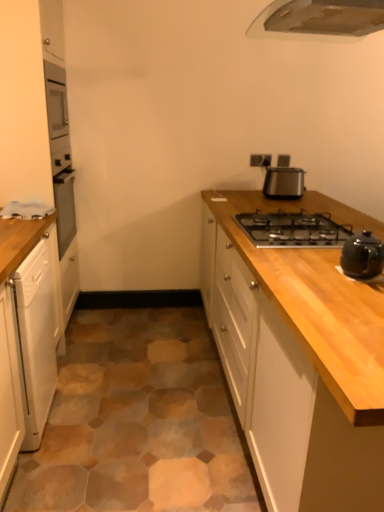
Question: Is metallic stainless steel toaster at upper right, marked as the first kitchen appliance in a back-to-front arrangement, outside of wooden cabinet at center, positioned as the first cabinetry in right-to-left order?

Choices:
 (A) no
 (B) yes

Answer: (B)

Question: Considering the relative sizes of metallic stainless steel toaster at upper right, the 2th kitchen appliance from the bottom, and wooden cabinet at center, the 3th cabinetry from the left, in the image provided, is metallic stainless steel toaster at upper right, the 2th kitchen appliance from the bottom, bigger than wooden cabinet at center, the 3th cabinetry from the left,?

Choices:
 (A) yes
 (B) no

Answer: (B)

Question: Does metallic stainless steel toaster at upper right, marked as the first kitchen appliance in a back-to-front arrangement, have a lesser width compared to wooden cabinet at center, the 3th cabinetry from the left?

Choices:
 (A) yes
 (B) no

Answer: (A)

Question: From the image's perspective, is metallic stainless steel toaster at upper right, the 2th kitchen appliance from the bottom, located beneath wooden cabinet at center, the 3th cabinetry from the left?

Choices:
 (A) yes
 (B) no

Answer: (B)

Question: Is metallic stainless steel toaster at upper right, marked as the first kitchen appliance in a back-to-front arrangement, aimed at wooden cabinet at center, the 3th cabinetry from the left?

Choices:
 (A) no
 (B) yes

Answer: (A)

Question: Looking at their shapes, would you say metallic stainless steel toaster at upper right, the 2th kitchen appliance from the bottom, is wider or thinner than metallic silver outlet at upper right?

Choices:
 (A) wide
 (B) thin

Answer: (A)

Question: Is metallic stainless steel toaster at upper right, marked as the first kitchen appliance in a back-to-front arrangement, to the left or to the right of metallic silver outlet at upper right in the image?

Choices:
 (A) left
 (B) right

Answer: (B)

Question: Considering the positions of metallic stainless steel toaster at upper right, which is counted as the 2th kitchen appliance, starting from the front, and metallic silver outlet at upper right in the image, is metallic stainless steel toaster at upper right, which is counted as the 2th kitchen appliance, starting from the front, taller or shorter than metallic silver outlet at upper right?

Choices:
 (A) short
 (B) tall

Answer: (B)

Question: From a real-world perspective, is metallic stainless steel toaster at upper right, which is counted as the 2th kitchen appliance, starting from the front, above or below metallic silver outlet at upper right?

Choices:
 (A) above
 (B) below

Answer: (B)

Question: In the image, is black ceramic teapot at right, which is the 2th kitchen appliance from top to bottom, on the left side or the right side of white glossy dishwasher at left, the 3th cabinetry viewed from the right?

Choices:
 (A) left
 (B) right

Answer: (B)

Question: From a real-world perspective, is black ceramic teapot at right, which is the 2th kitchen appliance from top to bottom, above or below white glossy dishwasher at left, marked as the first cabinetry in a left-to-right arrangement?

Choices:
 (A) below
 (B) above

Answer: (A)

Question: In terms of size, does black ceramic teapot at right, the second kitchen appliance from the back, appear bigger or smaller than white glossy dishwasher at left, marked as the first cabinetry in a left-to-right arrangement?

Choices:
 (A) big
 (B) small

Answer: (B)

Question: Is black ceramic teapot at right, which appears as the first kitchen appliance when viewed from the front, in front of or behind white glossy dishwasher at left, marked as the first cabinetry in a left-to-right arrangement, in the image?

Choices:
 (A) front
 (B) behind

Answer: (A)

Question: Is white glossy dishwasher at left, marked as the first cabinetry in a left-to-right arrangement, taller or shorter than metallic stainless steel toaster at upper right, which is counted as the 2th kitchen appliance, starting from the front?

Choices:
 (A) tall
 (B) short

Answer: (A)

Question: Is white glossy dishwasher at left, marked as the first cabinetry in a left-to-right arrangement, situated inside metallic stainless steel toaster at upper right, the 2th kitchen appliance from the bottom, or outside?

Choices:
 (A) outside
 (B) inside

Answer: (A)